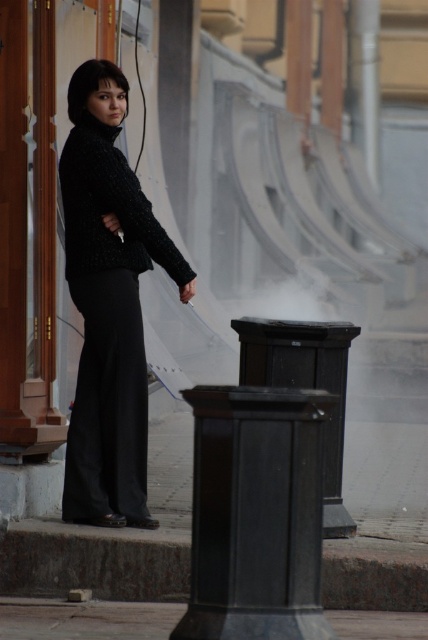
Is black matte trash can at lower center taller than smooth concrete pavement at lower center?

Yes, black matte trash can at lower center is taller than smooth concrete pavement at lower center.

Is point (326, 538) in front of point (160, 636)?

That is False.

The image size is (428, 640). Find the location of `black matte trash can at lower center`. black matte trash can at lower center is located at coordinates (305, 387).

You are a GUI agent. You are given a task and a screenshot of the screen. Output one action in this format:
    pyautogui.click(x=<x>, y=<y>)
    Task: Click on the black matte trash can at lower center
    
    Given the screenshot: What is the action you would take?
    pyautogui.click(x=305, y=387)

Between matte black sweater at center and smooth concrete pavement at lower center, which one is positioned lower?

smooth concrete pavement at lower center is lower down.

In the scene shown: Is matte black sweater at center to the left of smooth concrete pavement at lower center from the viewer's perspective?

In fact, matte black sweater at center is to the right of smooth concrete pavement at lower center.

Image resolution: width=428 pixels, height=640 pixels. Describe the element at coordinates (109, 305) in the screenshot. I see `matte black sweater at center` at that location.

I want to click on matte black sweater at center, so click(x=109, y=305).

Does black glossy trash can at lower right appear under black matte trash can at lower center?

Yes.

Does black glossy trash can at lower right appear on the left side of black matte trash can at lower center?

Yes, black glossy trash can at lower right is to the left of black matte trash can at lower center.

Between point (219, 515) and point (333, 362), which one is positioned behind?

Point (333, 362)

Where is `black glossy trash can at lower right`? The image size is (428, 640). black glossy trash can at lower right is located at coordinates (255, 515).